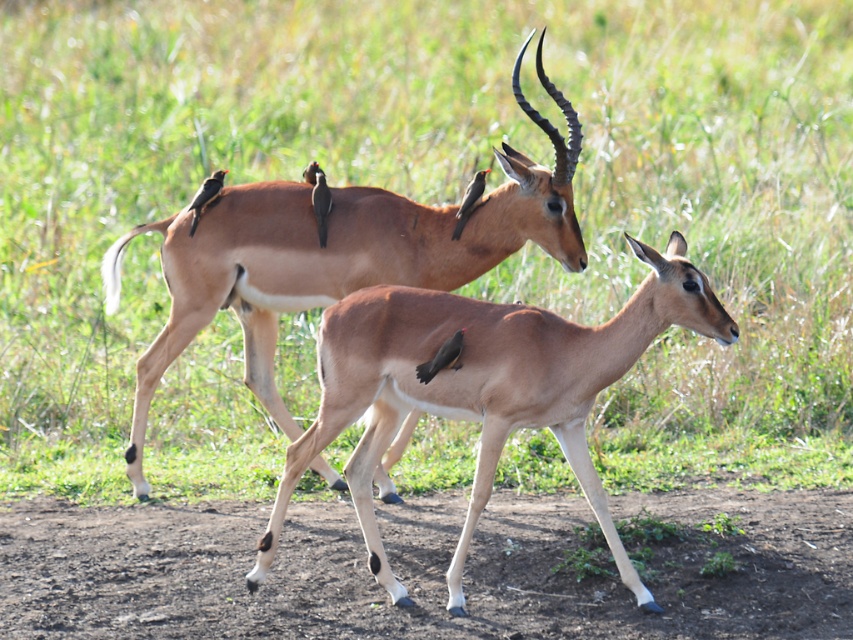
You are a photographer trying to capture a photo of both the brown glossy antelope at center and the light brown smooth deer at center. Since you want them both in the frame, can you tell me which one is positioned to the left of the other?

The brown glossy antelope at center is positioned to the left of the light brown smooth deer at center.

From the picture: You are a photographer trying to capture a closeup shot of both the brown glossy antelope at center and the light brown smooth deer at center. Your camera has a maximum focus range of 35 inches. Can you get both subjects in focus at the same time?

The brown glossy antelope at center is 38.89 inches away from the light brown smooth deer at center. Since the distance between them exceeds the camera maximum focus range of 35 inches, you cannot get both subjects in focus at the same time.

From the picture: You are a photographer standing at the edge of the grassy field. You want to take a photo of the brown glossy antelope at center. If your camera has a minimum focusing distance of 5 meters, will you be able to take a clear photo?

A: The brown glossy antelope at center is 4.40 meters from camera, which is closer than the camera minimum focusing distance of 5 meters. Therefore, the camera cannot focus properly and the photo will be blurry.